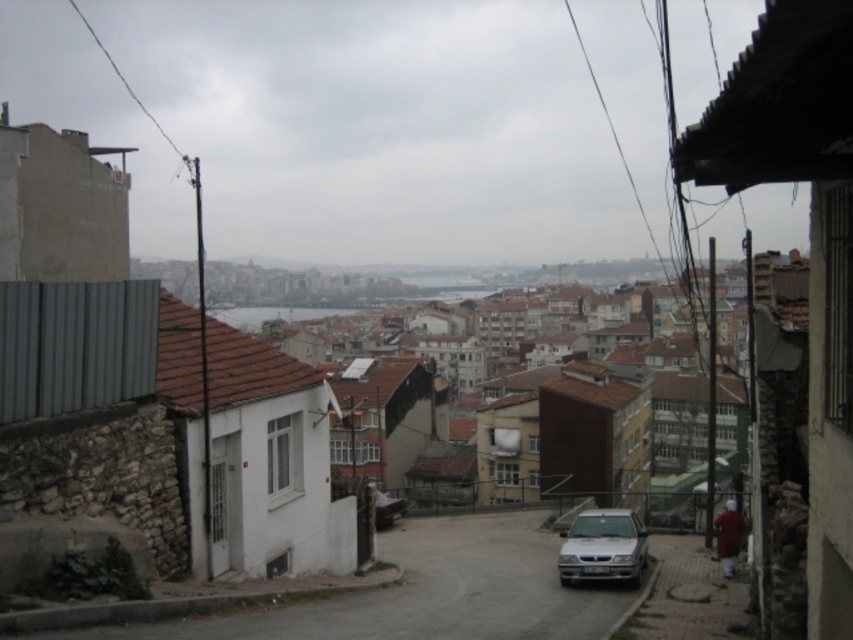
You are a delivery driver trying to navigate through the narrow road in the image. You need to pass the silver metallic car at lower center and the metallic silver car at center. Which car should you avoid hitting first?

The silver metallic car at lower center is positioned on the right side of metallic silver car at center. Therefore, you should avoid hitting the metallic silver car at center first since it is closer to your path.

You are driving a car and want to park in the parking spot ahead. There are two cars in the image, a silver metallic car at lower center and a metallic silver car at center. Which car is closer to the parking spot?

The silver metallic car at lower center is closer to the parking spot because it is in front of the metallic silver car at center.